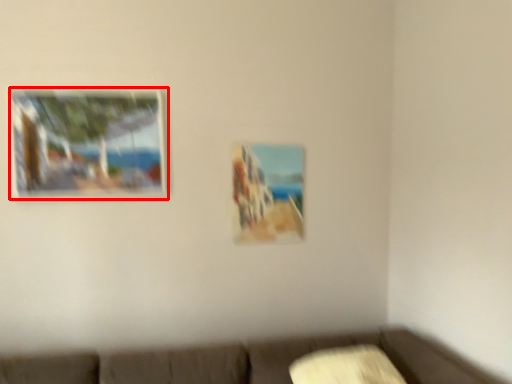
Question: From the image's perspective, what is the correct spatial relationship of picture frame (annotated by the red box) in relation to picture frame?

Choices:
 (A) above
 (B) below

Answer: (A)